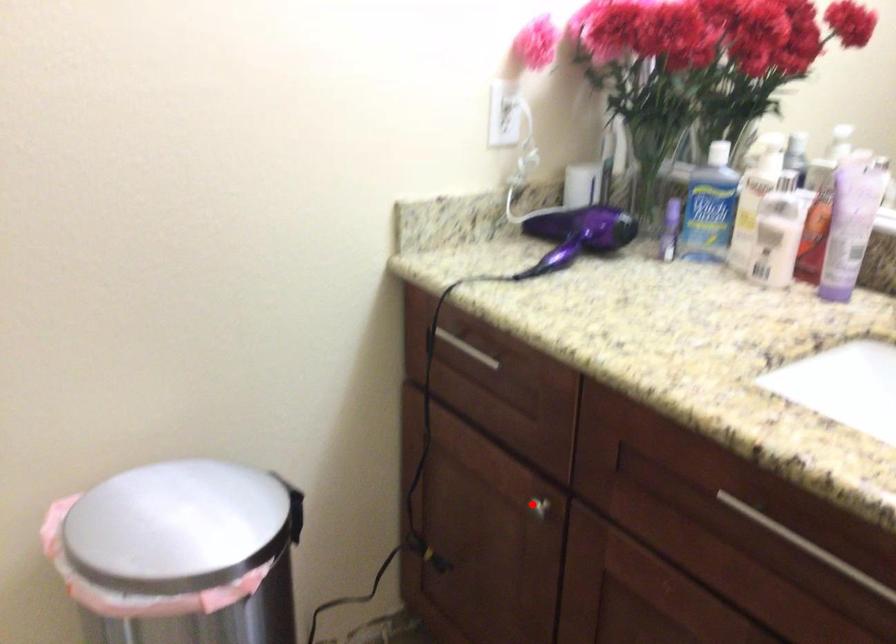
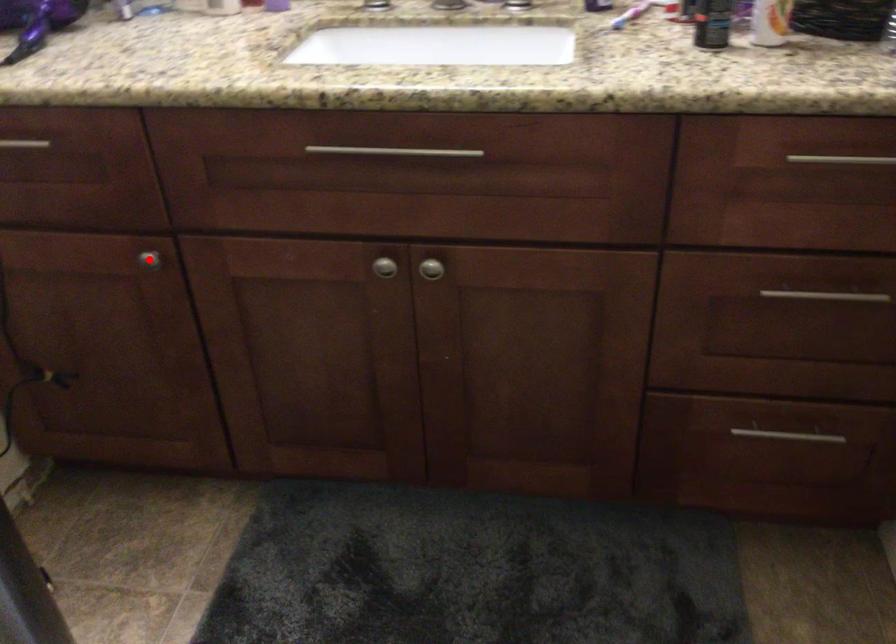
I am providing you with two images of the same scene from different viewpoints. A red point is marked on the first image and another point is marked on the second image. Is the red point in image1 aligned with the point shown in image2?

Yes